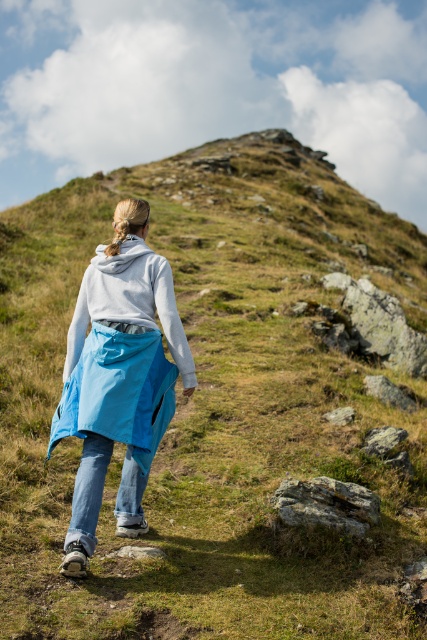
Does light gray fleece sweatshirt at center appear on the right side of denim jeans at lower center?

In fact, light gray fleece sweatshirt at center is to the left of denim jeans at lower center.

Who is taller, light gray fleece sweatshirt at center or denim jeans at lower center?

Standing taller between the two is light gray fleece sweatshirt at center.

Who is more forward, (119,304) or (132,460)?

Point (132,460) is more forward.

Locate an element on the screen. Image resolution: width=427 pixels, height=640 pixels. light gray fleece sweatshirt at center is located at coordinates (129, 300).

Who is lower down, blue waterproof skirt at center or denim jeans at lower center?

denim jeans at lower center is lower down.

Image resolution: width=427 pixels, height=640 pixels. What do you see at coordinates (119, 392) in the screenshot?
I see `blue waterproof skirt at center` at bounding box center [119, 392].

Is point (60, 428) positioned behind point (84, 504)?

Yes, point (60, 428) is behind point (84, 504).

The image size is (427, 640). Find the location of `blue waterproof skirt at center`. blue waterproof skirt at center is located at coordinates (119, 392).

Looking at this image, is denim jeans at lower center bigger than gray rough rock at lower center?

Correct, denim jeans at lower center is larger in size than gray rough rock at lower center.

Can you confirm if denim jeans at lower center is positioned to the left of gray rough rock at lower center?

Yes, denim jeans at lower center is to the left of gray rough rock at lower center.

Is point (91, 490) closer to camera compared to point (292, 490)?

Yes, it is in front of point (292, 490).

Locate an element on the screen. The width and height of the screenshot is (427, 640). denim jeans at lower center is located at coordinates (88, 490).